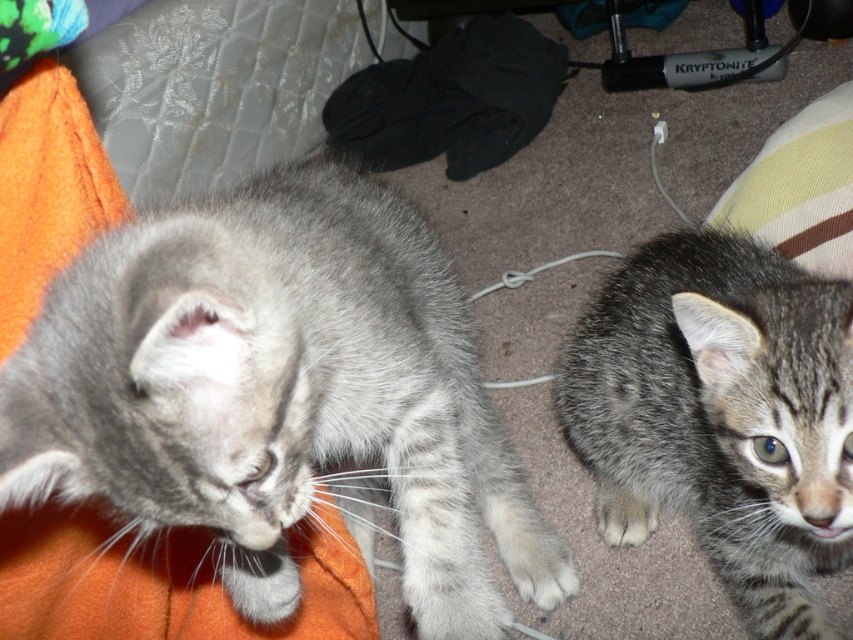
Question: Does tabby fur cat at center have a lesser width compared to white fur at lower right?

Choices:
 (A) no
 (B) yes

Answer: (A)

Question: Which object is positioned farthest from the white fur at lower right?

Choices:
 (A) fuzzy gray cat at upper left
 (B) gray tabby cat at left
 (C) tabby fur cat at center

Answer: (A)

Question: Among these objects, which one is farthest from the camera?

Choices:
 (A) tabby fur cat at center
 (B) gray tabby cat at left
 (C) fuzzy gray cat at upper left
 (D) white fur at lower right

Answer: (C)

Question: Can you confirm if tabby fur cat at center is positioned above fuzzy gray cat at upper left?

Choices:
 (A) no
 (B) yes

Answer: (A)

Question: Among these points, which one is nearest to the camera?

Choices:
 (A) (299, 84)
 (B) (637, 269)

Answer: (B)

Question: Can you confirm if fuzzy gray cat at upper left is bigger than white fur at lower right?

Choices:
 (A) yes
 (B) no

Answer: (A)